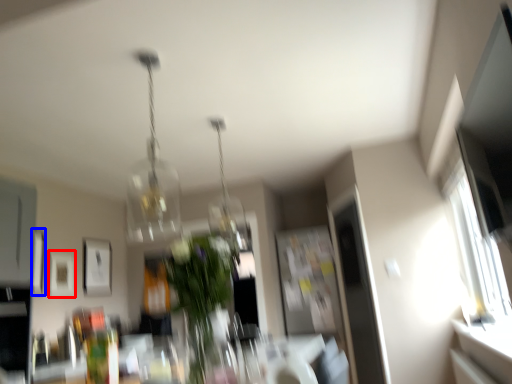
Question: Which of the following is the farthest to the observer, picture frame (highlighted by a red box) or picture frame (highlighted by a blue box)?

Choices:
 (A) picture frame
 (B) picture frame

Answer: (A)